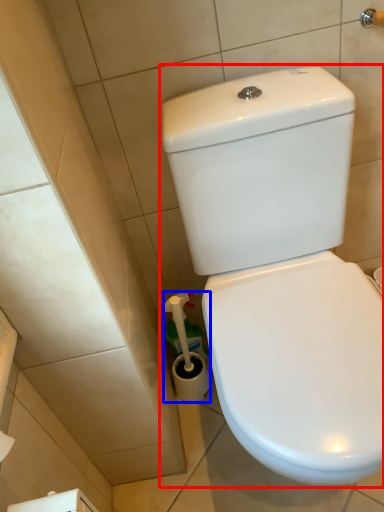
Question: Which object is further to the camera taking this photo, toilet (highlighted by a red box) or brush (highlighted by a blue box)?

Choices:
 (A) toilet
 (B) brush

Answer: (B)